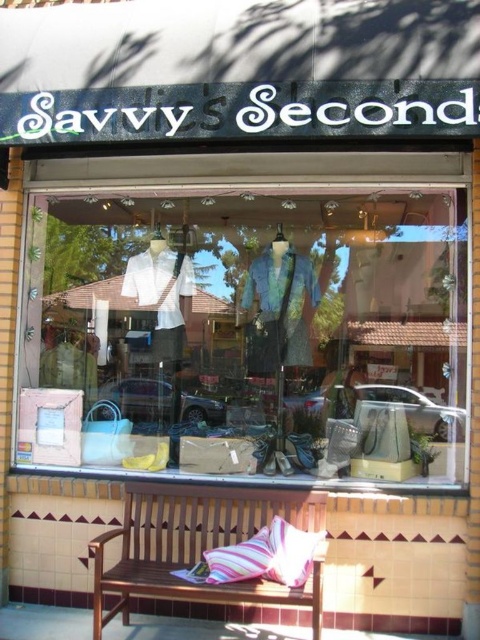
You are a customer looking to purchase a gift for a friend who loves home decor. You see the matte glass display at center and the striped fabric pillow at center in the store window. Which item would you choose if you want something bigger for a coffee table?

The matte glass display at center is larger in size than the striped fabric pillow at center, so you should choose the matte glass display at center for a bigger item on the coffee table.

From the picture: You are a customer entering the store and want to sit down. You see a brown wooden bench at center and a striped fabric pillow at center. Which one is closer to you?

The brown wooden bench at center is closer to you because it is in front of the striped fabric pillow at center.

You are standing in front of the store window and notice two points marked on the window. One is at coordinate point (160,515) and the other at point (303,579). Which point is closer to the bottom edge of the window?

Point (303,579) is closer to the bottom edge of the window because it has a higher y coordinate value than point (160,515).